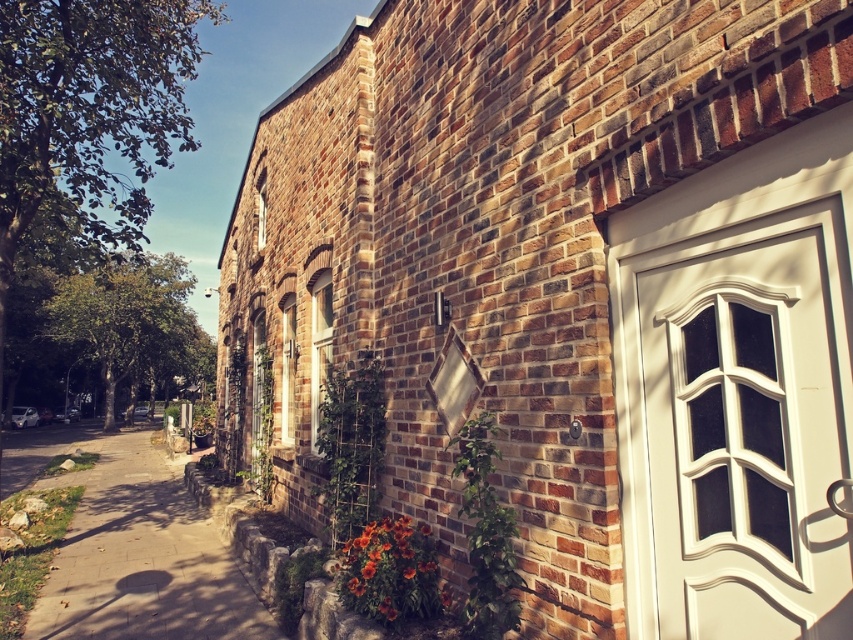
You are standing at the entrance of the brick building and want to walk to the gray concrete sidewalk at lower left. Based on the coordinates provided, in which direction should you move relative to the building?

You should move towards the lower left direction relative to the building to reach the gray concrete sidewalk at lower left located at point (137, 550).

You are standing on the gray concrete sidewalk at lower left and want to place a small potted plant on the vibrant orange petals at lower center. Considering their heights, will the plant be visible from above when placed there?

The gray concrete sidewalk at lower left is taller than vibrant orange petals at lower center, so placing the potted plant on the vibrant orange petals at lower center would position it lower than the sidewalk. Since the petals are lower, the plant would be visible from above as it won

You are standing at the point marked by the coordinates point (137, 550). Looking at the brick building in front of you, which direction should you walk to reach the gray concrete sidewalk at lower left?

The point (137, 550) marks the gray concrete sidewalk at lower left, so you are already standing on it.